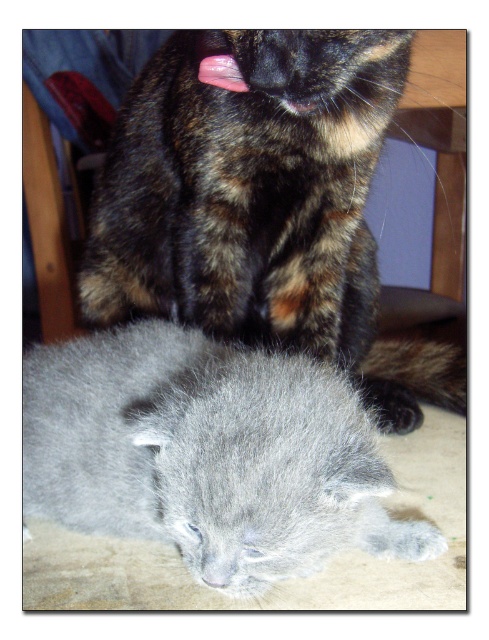
From the picture: You are a photographer setting up a camera to capture both the fluffy tortoiseshell cat at upper center and the gray fluffy kitten at lower center in the same frame. Based on their positions, which cat should you focus on first to ensure both are in focus?

The fluffy tortoiseshell cat at upper center is much taller than the gray fluffy kitten at lower center, so focusing on the taller cat first will help ensure both are in focus.

You are a photographer trying to capture both cats in a single shot. Since the fluffy tortoiseshell cat at upper center is blocking the view of the gray fluffy kitten at lower center, how can you adjust your position to include both in the frame?

Move to the side of the fluffy tortoiseshell cat at upper center so that the gray fluffy kitten at lower center is no longer blocked. Since the gray fluffy kitten at lower center is behind the fluffy tortoiseshell cat at upper center, shifting your angle will allow both to be visible in the photo.

You are a cat owner who wants to place a small toy between the fluffy tortoiseshell cat at upper center and the gray fluffy kitten at lower center. The toy requires a minimum of 18 inches of space to fit. Based on the scene, will there be enough space between them for the toy?

The fluffy tortoiseshell cat at upper center and the gray fluffy kitten at lower center are 17.48 inches apart from each other. Since the required space is 18 inches, the toy will not fit between them.